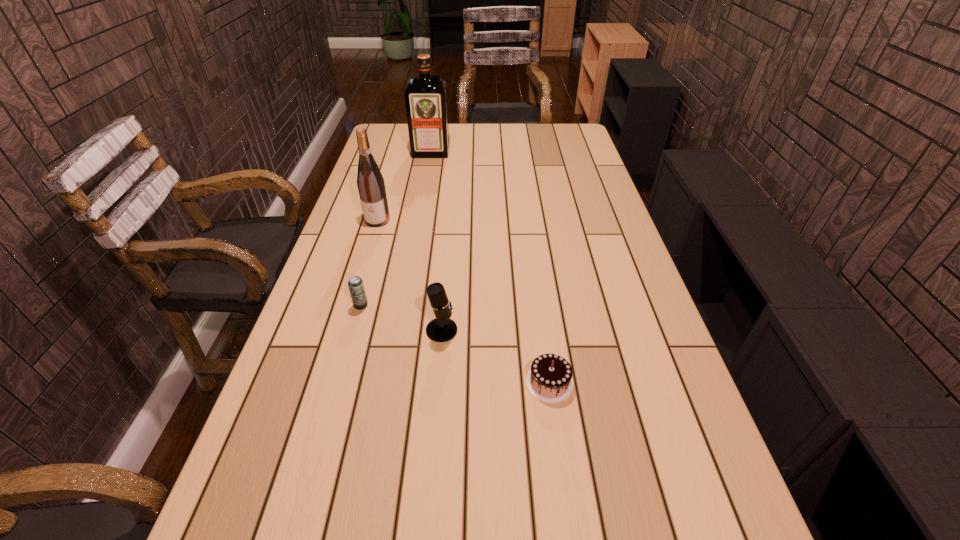
Where is `vacant space that's between the chocolate cake and the wine bottle`? vacant space that's between the chocolate cake and the wine bottle is located at coordinates (464, 301).

I want to click on object that is the closest to the fourth nearest object, so click(356, 287).

Identify the location of object that stands as the fourth closest to the second farthest object. (549, 380).

Find the location of a particular element. This screenshot has width=960, height=540. free point that satisfies the following two spatial constraints: 1. on the front side of the third shortest object; 2. on the left side of the chocolate cake is located at coordinates click(438, 383).

Find the location of a particular element. The height and width of the screenshot is (540, 960). free location that satisfies the following two spatial constraints: 1. on the front label of the tallest object; 2. on the right side of the chocolate cake is located at coordinates (389, 383).

You are a GUI agent. You are given a task and a screenshot of the screen. Output one action in this format:
    pyautogui.click(x=<x>, y=<y>)
    Task: Click on the vacant space that satisfies the following two spatial constraints: 1. on the front label of the tallest object; 2. on the right side of the rightmost object
    
    Given the screenshot: What is the action you would take?
    pyautogui.click(x=389, y=383)